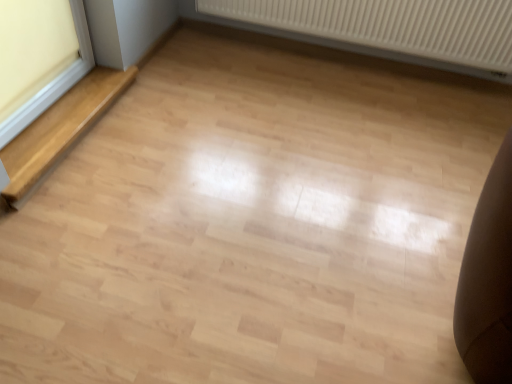
Image resolution: width=512 pixels, height=384 pixels. Describe the element at coordinates (59, 130) in the screenshot. I see `light wood stairwell at left` at that location.

Describe the element at coordinates (53, 81) in the screenshot. I see `white plastic window frame at left` at that location.

The height and width of the screenshot is (384, 512). In order to click on light wood stairwell at left in this screenshot , I will do `click(59, 130)`.

Which is correct: light wood stairwell at left is inside white ribbed radiator at upper center, or outside of it?

light wood stairwell at left cannot be found inside white ribbed radiator at upper center.

Relative to white ribbed radiator at upper center, is light wood stairwell at left in front or behind?

Clearly, light wood stairwell at left is in front of white ribbed radiator at upper center.

Considering the sizes of light wood stairwell at left and white ribbed radiator at upper center in the image, is light wood stairwell at left bigger or smaller than white ribbed radiator at upper center?

light wood stairwell at left is smaller than white ribbed radiator at upper center.

From a real-world perspective, relative to white ribbed radiator at upper center, is light wood stairwell at left vertically above or below?

In terms of real-world spatial position, light wood stairwell at left is below white ribbed radiator at upper center.

Find the location of a particular element. The width and height of the screenshot is (512, 384). radiator below the white plastic window frame at left (from a real-world perspective) is located at coordinates (392, 28).

Considering the sizes of objects white plastic window frame at left and white ribbed radiator at upper center in the image provided, who is taller, white plastic window frame at left or white ribbed radiator at upper center?

white plastic window frame at left is taller.

Consider the image. How many degrees apart are the facing directions of white plastic window frame at left and white ribbed radiator at upper center?

89 degrees.

Is point (369, 17) positioned after point (82, 84)?

Yes, point (369, 17) is behind point (82, 84).

Who is bigger, white ribbed radiator at upper center or light wood stairwell at left?

Bigger between the two is white ribbed radiator at upper center.

From the image's perspective, between white ribbed radiator at upper center and white plastic window frame at left, who is located below?

white plastic window frame at left, from the image's perspective.

Looking at this image, from a real-world perspective, between white ribbed radiator at upper center and white plastic window frame at left, who is vertically lower?

white ribbed radiator at upper center.

Is the depth of white ribbed radiator at upper center less than that of white plastic window frame at left?

No.

From the image's perspective, does white plastic window frame at left appear higher than light wood stairwell at left?

Yes.

Based on the photo, is white plastic window frame at left wider than light wood stairwell at left?

No.

From a real-world perspective, who is located lower, white plastic window frame at left or light wood stairwell at left?

In real-world perspective, light wood stairwell at left is lower.

How different are the orientations of white plastic window frame at left and light wood stairwell at left in degrees?

The angle between the facing direction of white plastic window frame at left and the facing direction of light wood stairwell at left is 0.924 degrees.

In terms of size, does light wood stairwell at left appear bigger or smaller than white plastic window frame at left?

In the image, light wood stairwell at left appears to be larger than white plastic window frame at left.

What's the angular difference between light wood stairwell at left and white plastic window frame at left's facing directions?

The facing directions of light wood stairwell at left and white plastic window frame at left are 0.924 degrees apart.

Is light wood stairwell at left taller or shorter than white plastic window frame at left?

Considering their sizes, light wood stairwell at left has less height than white plastic window frame at left.

Could white plastic window frame at left be considered to be inside light wood stairwell at left?

No, white plastic window frame at left is not a part of light wood stairwell at left.

Locate an element on the screen. Image resolution: width=512 pixels, height=384 pixels. stairwell that appears below the white ribbed radiator at upper center (from a real-world perspective) is located at coordinates (59, 130).

Where is `window frame located in front of the white ribbed radiator at upper center`? window frame located in front of the white ribbed radiator at upper center is located at coordinates (53, 81).

Looking at the image, which one is located closer to light wood stairwell at left, white plastic window frame at left or white ribbed radiator at upper center?

Among the two, white plastic window frame at left is located nearer to light wood stairwell at left.

Based on their spatial positions, is white ribbed radiator at upper center or light wood stairwell at left closer to white plastic window frame at left?

light wood stairwell at left lies closer to white plastic window frame at left than the other object.

Considering their positions, is white ribbed radiator at upper center positioned further to light wood stairwell at left than white plastic window frame at left?

white ribbed radiator at upper center is positioned further to the anchor light wood stairwell at left.

Which object lies nearer to the anchor point white ribbed radiator at upper center, white plastic window frame at left or light wood stairwell at left?

light wood stairwell at left.

From the image, which object appears to be farther from white ribbed radiator at upper center, light wood stairwell at left or white plastic window frame at left?

The object further to white ribbed radiator at upper center is white plastic window frame at left.

Considering their positions, is light wood stairwell at left positioned closer to white plastic window frame at left than white ribbed radiator at upper center?

light wood stairwell at left is positioned closer to the anchor white plastic window frame at left.

Find the location of a particular element. Image resolution: width=512 pixels, height=384 pixels. stairwell between white plastic window frame at left and white ribbed radiator at upper center in the horizontal direction is located at coordinates (59, 130).